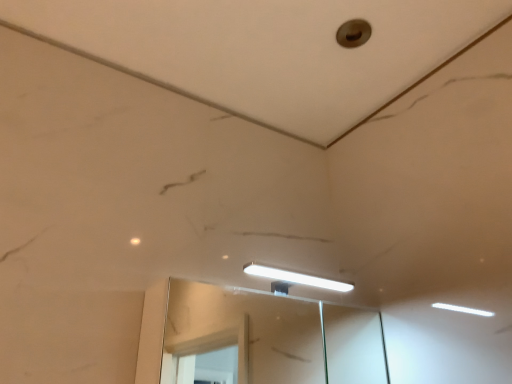
This screenshot has height=384, width=512. What are the coordinates of `metallic circular hole at upper center` in the screenshot? It's located at (353, 33).

The height and width of the screenshot is (384, 512). Describe the element at coordinates (353, 33) in the screenshot. I see `metallic circular hole at upper center` at that location.

Measure the distance between point (x=353, y=45) and camera.

They are 4.28 feet apart.

Identify the location of clear glass mirror at center. (247, 331).

Describe the element at coordinates (247, 331) in the screenshot. The width and height of the screenshot is (512, 384). I see `clear glass mirror at center` at that location.

Measure the distance between point [214,293] and camera.

The distance of point [214,293] from camera is 1.90 meters.

Measure the distance between clear glass mirror at center and camera.

1.13 meters.

Locate an element on the screen. The width and height of the screenshot is (512, 384). metallic circular hole at upper center is located at coordinates (353, 33).

Is metallic circular hole at upper center at the right side of clear glass mirror at center?

Correct, you'll find metallic circular hole at upper center to the right of clear glass mirror at center.

Is metallic circular hole at upper center further to the viewer compared to clear glass mirror at center?

Yes, metallic circular hole at upper center is further from the camera.

Looking at this image, which is farther from the camera, [350,31] or [285,349]?

The point [285,349] is farther.

From the image's perspective, between metallic circular hole at upper center and clear glass mirror at center, which one is located above?

metallic circular hole at upper center is shown above in the image.

From a real-world perspective, who is located lower, metallic circular hole at upper center or clear glass mirror at center?

clear glass mirror at center, from a real-world perspective.

Does metallic circular hole at upper center have a lesser width compared to clear glass mirror at center?

Yes.

From their relative heights in the image, would you say metallic circular hole at upper center is taller or shorter than clear glass mirror at center?

In the image, metallic circular hole at upper center appears to be shorter than clear glass mirror at center.

Who is smaller, metallic circular hole at upper center or clear glass mirror at center?

With smaller size is metallic circular hole at upper center.

Would you say metallic circular hole at upper center is inside or outside clear glass mirror at center?

metallic circular hole at upper center cannot be found inside clear glass mirror at center.

Looking at this image, is metallic circular hole at upper center next to clear glass mirror at center and touching it?

They are not placed beside each other.

Looking at this image, is metallic circular hole at upper center oriented towards clear glass mirror at center?

No, metallic circular hole at upper center is not facing towards clear glass mirror at center.

At what (x,y) coordinates should I click in order to perform the action: click on hole behind the clear glass mirror at center. Please return your answer as a coordinate pair (x, y). Looking at the image, I should click on (353, 33).

Considering the relative positions of clear glass mirror at center and metallic circular hole at upper center in the image provided, is clear glass mirror at center to the left of metallic circular hole at upper center from the viewer's perspective?

Indeed, clear glass mirror at center is positioned on the left side of metallic circular hole at upper center.

Is clear glass mirror at center in front of or behind metallic circular hole at upper center in the image?

clear glass mirror at center is positioned closer to the viewer than metallic circular hole at upper center.

Considering the positions of points (202, 315) and (340, 42), is point (202, 315) farther from camera compared to point (340, 42)?

Yes.

Consider the image. From the image's perspective, is clear glass mirror at center above metallic circular hole at upper center?

No.

From a real-world perspective, relative to metallic circular hole at upper center, is clear glass mirror at center vertically above or below?

From a real-world perspective, clear glass mirror at center is physically below metallic circular hole at upper center.

Which of these two, clear glass mirror at center or metallic circular hole at upper center, is thinner?

metallic circular hole at upper center.

Can you confirm if clear glass mirror at center is shorter than metallic circular hole at upper center?

Incorrect, the height of clear glass mirror at center does not fall short of that of metallic circular hole at upper center.

Does clear glass mirror at center have a smaller size compared to metallic circular hole at upper center?

Actually, clear glass mirror at center might be larger than metallic circular hole at upper center.

Is metallic circular hole at upper center completely or partially inside clear glass mirror at center?

No, metallic circular hole at upper center is not surrounded by clear glass mirror at center.

Are clear glass mirror at center and metallic circular hole at upper center far apart?

clear glass mirror at center is far away from metallic circular hole at upper center.

Does clear glass mirror at center turn towards metallic circular hole at upper center?

No, clear glass mirror at center is not aimed at metallic circular hole at upper center.

How many degrees apart are the facing directions of clear glass mirror at center and metallic circular hole at upper center?

The angle between the facing direction of clear glass mirror at center and the facing direction of metallic circular hole at upper center is 89 degrees.

The width and height of the screenshot is (512, 384). Identify the location of hole above the clear glass mirror at center (from a real-world perspective). (353, 33).

Where is `mirror below the metallic circular hole at upper center (from the image's perspective)`? mirror below the metallic circular hole at upper center (from the image's perspective) is located at coordinates (247, 331).

The height and width of the screenshot is (384, 512). Find the location of `hole on the right of clear glass mirror at center`. hole on the right of clear glass mirror at center is located at coordinates (353, 33).